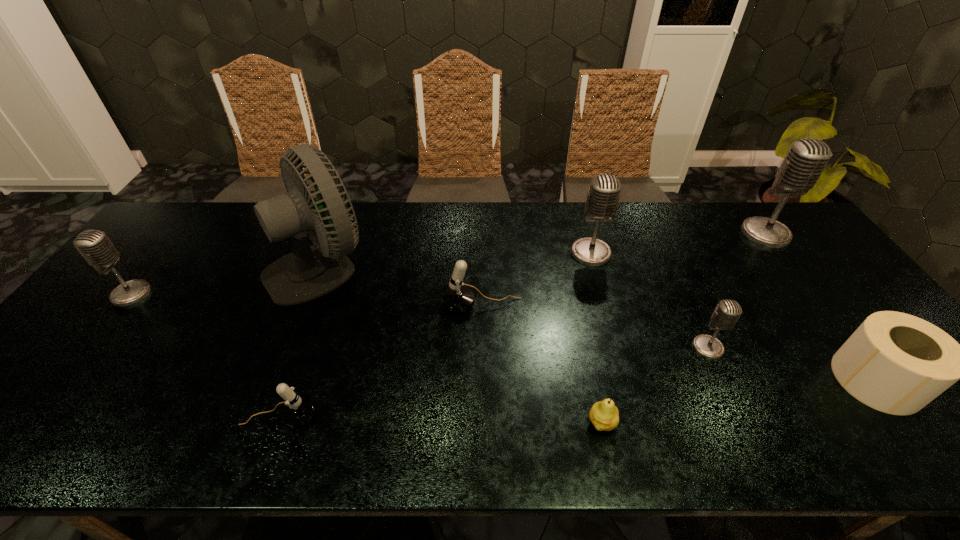
At what (x,y) coordinates should I click in order to perform the action: click on free spot between the leftmost microphone and the toilet tissue. Please return your answer as a coordinate pair (x, y). The image size is (960, 540). Looking at the image, I should click on (504, 337).

Locate an element on the screen. This screenshot has width=960, height=540. free area in between the fan and the second smallest gray microphone is located at coordinates (226, 280).

Where is `empty space between the shortest object and the toilet tissue`? Image resolution: width=960 pixels, height=540 pixels. empty space between the shortest object and the toilet tissue is located at coordinates (739, 401).

Find the location of `vacant space that's between the pear and the smallest gray microphone`. vacant space that's between the pear and the smallest gray microphone is located at coordinates click(655, 385).

The height and width of the screenshot is (540, 960). Identify the location of vacant region between the pear and the right white microphone. (542, 364).

At what (x,y) coordinates should I click in order to perform the action: click on free space between the biggest gray microphone and the farther white microphone. Please return your answer as a coordinate pair (x, y). Looking at the image, I should click on (624, 269).

Where is `free space between the second gray microphone from right to left and the gray fan`? Image resolution: width=960 pixels, height=540 pixels. free space between the second gray microphone from right to left and the gray fan is located at coordinates (515, 307).

Identify which object is the second closest to the rightmost gray microphone. Please provide its 2D coordinates. Your answer should be formatted as a tuple, i.e. [(x, y)], where the tuple contains the x and y coordinates of a point satisfying the conditions above.

[(727, 312)]

Select which object appears as the fourth closest to the fifth microphone from left to right. Please provide its 2D coordinates. Your answer should be formatted as a tuple, i.e. [(x, y)], where the tuple contains the x and y coordinates of a point satisfying the conditions above.

[(458, 298)]

Where is `microphone that is the closest to the smaller white microphone`? The image size is (960, 540). microphone that is the closest to the smaller white microphone is located at coordinates (458, 298).